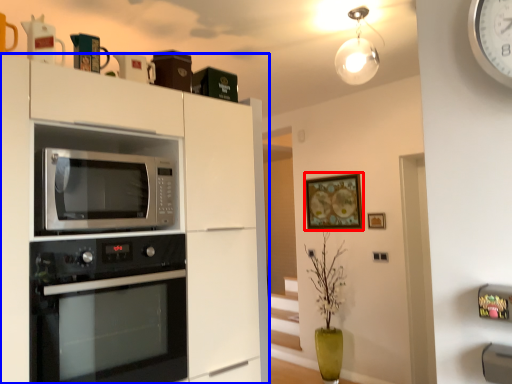
Question: Which of the following is the closest to the observer, picture frame (highlighted by a red box) or cabinetry (highlighted by a blue box)?

Choices:
 (A) picture frame
 (B) cabinetry

Answer: (B)